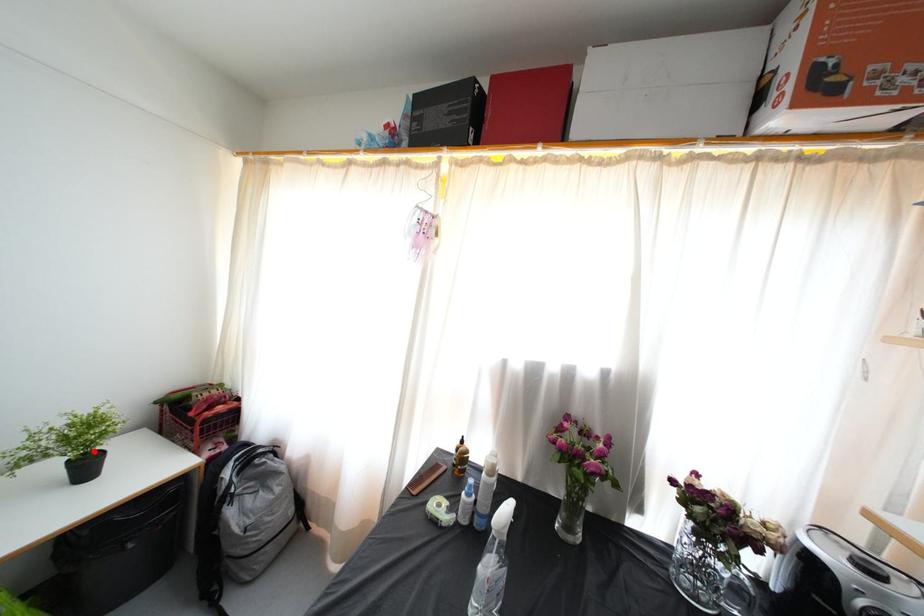
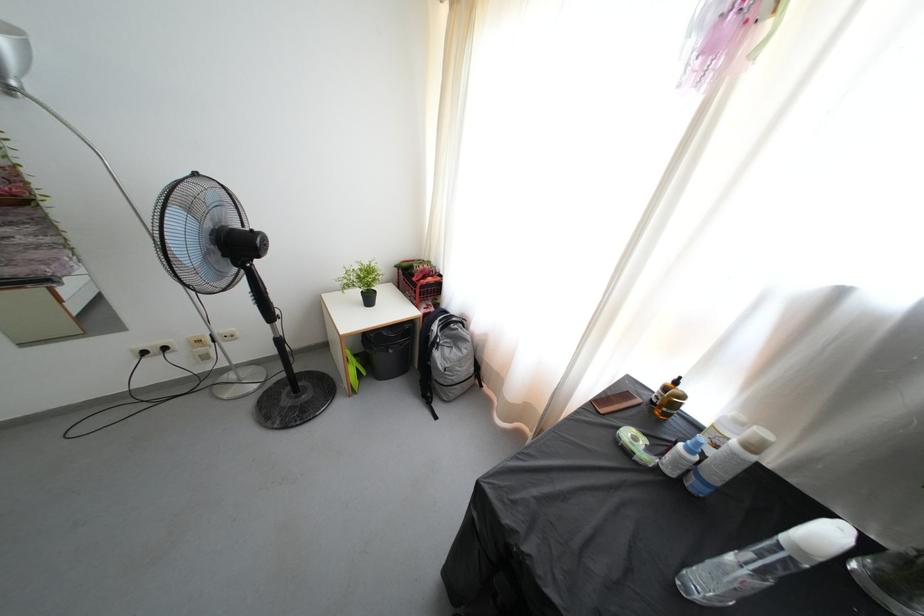
Question: I am providing you with two images of the same scene from different viewpoints. In image1, a red point is highlighted. Considering the same 3D point in image2, which of the following is correct?

Choices:
 (A) It is closer
 (B) It is farther

Answer: (A)